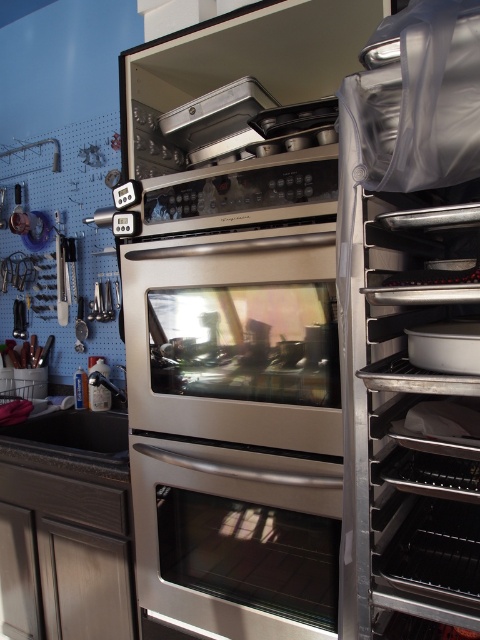
You are a chef who needs to place a baking tray in the oven. Based on the image, where is the silver metallic baking tray at right located relative to the metallic silver exhaust hood at upper center?

The silver metallic baking tray at right is located to the right of the metallic silver exhaust hood at upper center.

You are a kitchen designer planning to install a new appliance between the satin stainless steel oven at center and the metallic silver exhaust hood at upper center. The appliance requires a minimum of 24 inches of space. Based on the current setup, is there enough space to accommodate it?

The satin stainless steel oven at center and metallic silver exhaust hood at upper center are 26.95 inches apart from each other, which exceeds the required 24 inches. Therefore, there is sufficient space to install the new appliance between them.

What are the coordinates of the satin stainless steel oven at center?

The satin stainless steel oven at center is located at coordinates point (235, 429).